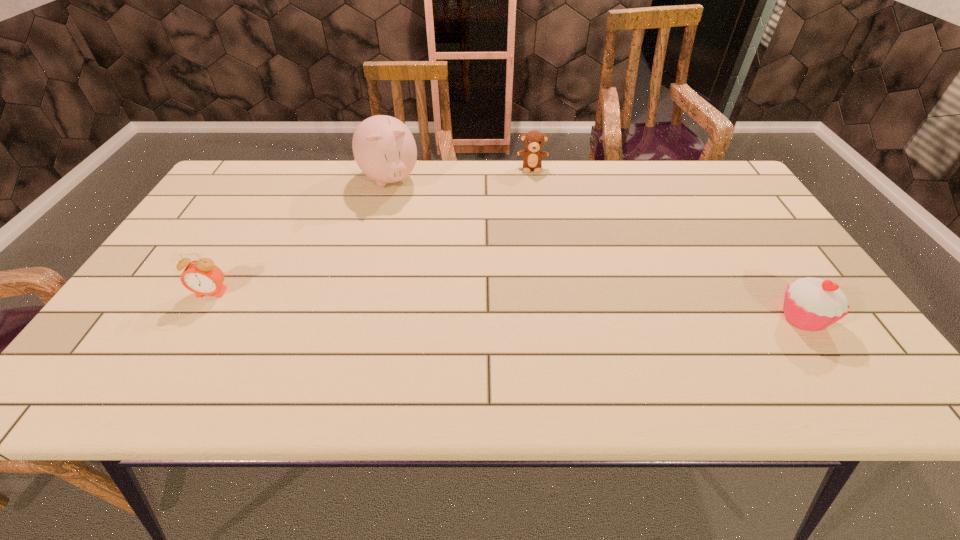
The image size is (960, 540). In order to click on vacant space at the near edge in this screenshot , I will do `click(585, 339)`.

This screenshot has width=960, height=540. Identify the location of vacant space at the left edge of the desktop. (221, 241).

Locate an element on the screen. This screenshot has height=540, width=960. free space at the right edge is located at coordinates (756, 216).

The image size is (960, 540). In order to click on empty space that is in between the alarm clock and the rightmost object in this screenshot , I will do `click(507, 306)`.

I want to click on vacant area that lies between the alarm clock and the second object from left to right, so click(300, 237).

The height and width of the screenshot is (540, 960). I want to click on free space between the cupcake and the tallest object, so click(x=595, y=249).

Identify the location of free spot between the piggy bank and the teddy bear. This screenshot has width=960, height=540. (461, 174).

Where is `free space between the rightmost object and the teddy bear`? The height and width of the screenshot is (540, 960). free space between the rightmost object and the teddy bear is located at coordinates (667, 243).

Where is `vacant space that's between the piggy bank and the alarm clock`? This screenshot has height=540, width=960. vacant space that's between the piggy bank and the alarm clock is located at coordinates (300, 237).

Find the location of `empty space between the cupcake and the piggy bank`. empty space between the cupcake and the piggy bank is located at coordinates (595, 249).